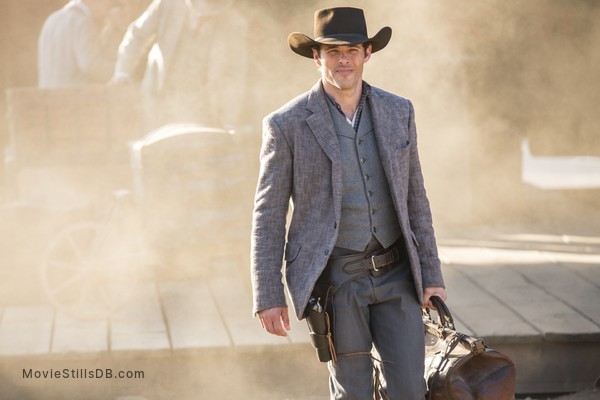
Locate an element on the screen. This screenshot has height=400, width=600. wooden planks is located at coordinates (24, 339), (86, 345), (136, 339), (203, 341), (249, 342), (499, 327), (546, 331), (576, 297), (591, 264).